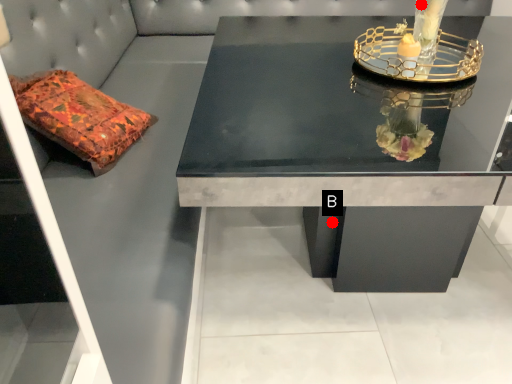
Question: Two points are circled on the image, labeled by A and B beside each circle. Which point is farther to the camera?

Choices:
 (A) A is further
 (B) B is further

Answer: (B)